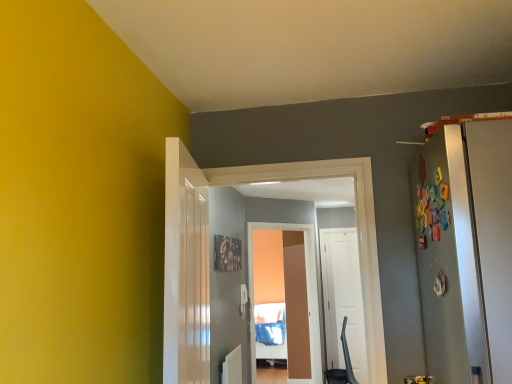
Question: Is point (177, 155) closer or farther from the camera than point (333, 306)?

Choices:
 (A) closer
 (B) farther

Answer: (A)

Question: Would you say white glossy door at center, the third door from the back, is to the left or to the right of white matte door at center, the 3th door positioned from the left, in the picture?

Choices:
 (A) left
 (B) right

Answer: (A)

Question: Estimate the real-world distances between objects in this image. Which object is closer to the white glossy door at center, which is counted as the 2th door, starting from the back?

Choices:
 (A) white glossy door at center, arranged as the third door when viewed from the right
 (B) matte brown screen door at center
 (C) white matte door at center, placed as the 3th door when sorted from front to back

Answer: (A)

Question: Estimate the real-world distances between objects in this image. Which object is closer to the white glossy door at center, the 2th door from the left?

Choices:
 (A) white glossy door at center, which is counted as the first door, starting from the front
 (B) matte brown screen door at center
 (C) white matte door at center, placed as the 3th door when sorted from front to back

Answer: (A)